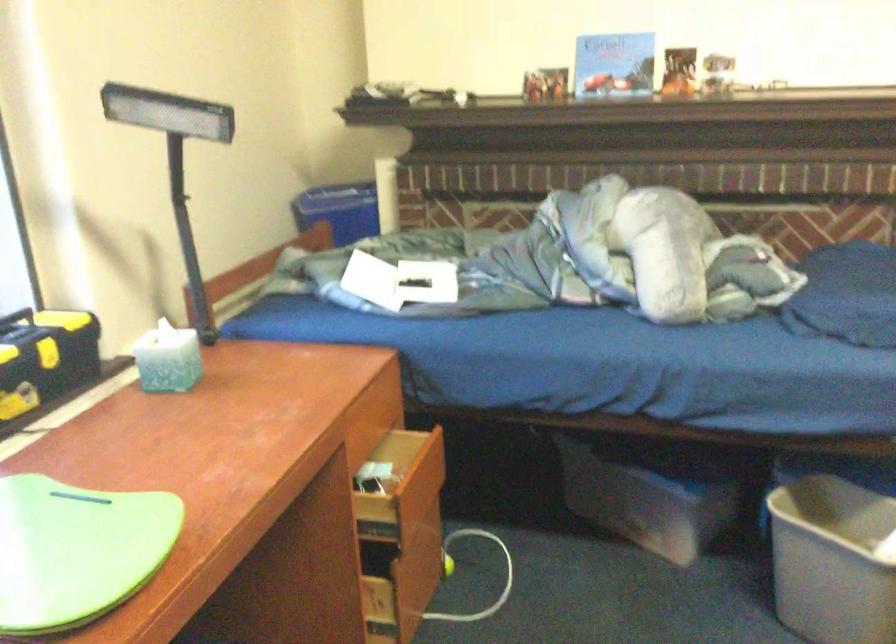
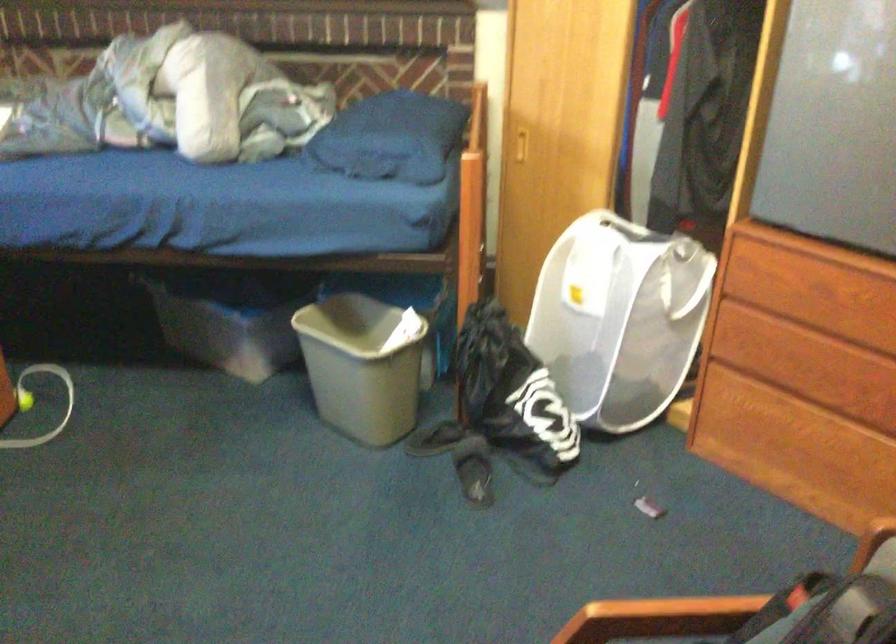
In a continuous first-person perspective shot, in which direction is the camera moving?

The cameraman walked toward right, backward.